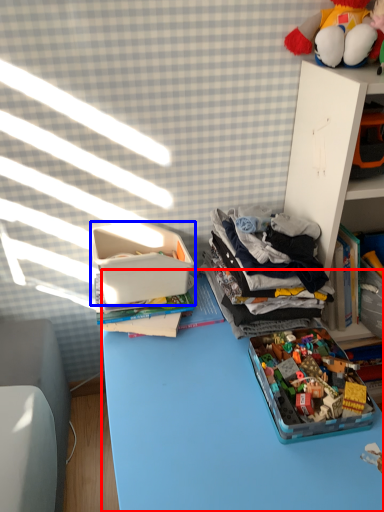
Question: Which of the following is the closest to the observer, desk (highlighted by a red box) or storage box (highlighted by a blue box)?

Choices:
 (A) desk
 (B) storage box

Answer: (A)